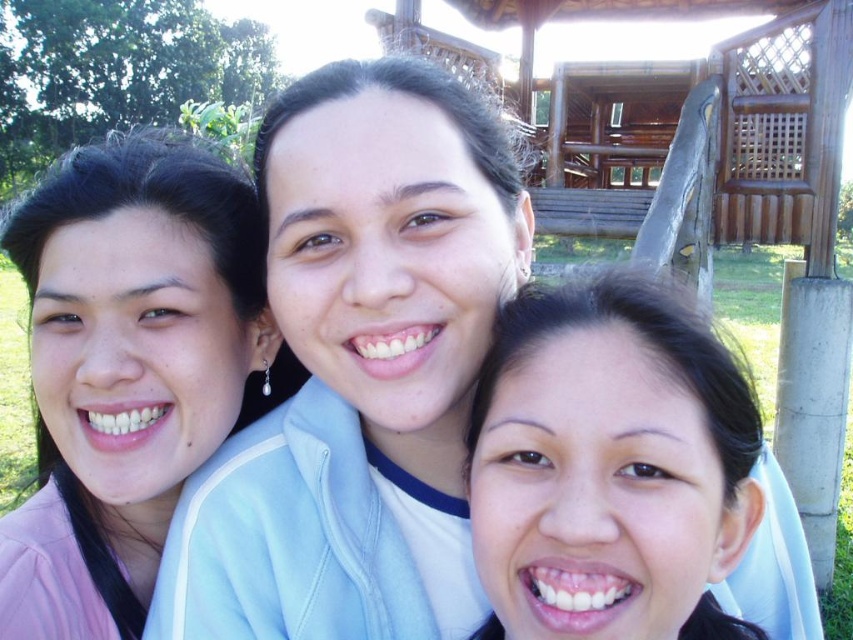
Measure the distance from matte pink jacket at left to smooth skin face at center.

matte pink jacket at left is 3.13 meters from smooth skin face at center.

Can you confirm if matte pink jacket at left is positioned above smooth skin face at center?

Yes.

Is point (61, 257) in front of point (590, 410)?

No, (61, 257) is behind (590, 410).

Find the location of a particular element. matte pink jacket at left is located at coordinates tap(128, 369).